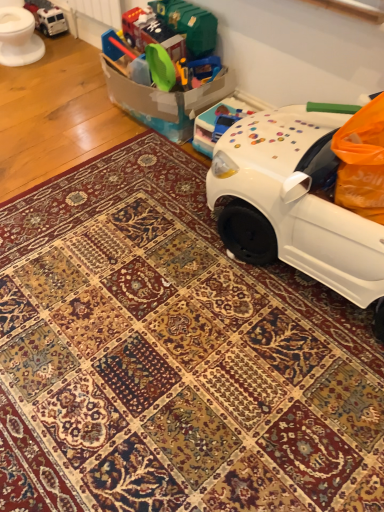
Where is `metallic silver truck at upper left, arranged as the 1th toy when viewed from the top`? metallic silver truck at upper left, arranged as the 1th toy when viewed from the top is located at coordinates (47, 17).

The height and width of the screenshot is (512, 384). Describe the element at coordinates (216, 123) in the screenshot. I see `translucent plastic toy car at upper right, the 2th toy viewed from the back` at that location.

Locate an element on the screen. The height and width of the screenshot is (512, 384). white glossy toilet bowl at upper left is located at coordinates (19, 37).

Locate an element on the screen. metallic silver truck at upper left, placed as the second toy when sorted from bottom to top is located at coordinates (47, 17).

In terms of height, does translucent plastic toy car at upper right, acting as the 2th toy starting from the top, look taller or shorter compared to white glossy toilet bowl at upper left?

In the image, translucent plastic toy car at upper right, acting as the 2th toy starting from the top, appears to be shorter than white glossy toilet bowl at upper left.

From the image's perspective, which is below, translucent plastic toy car at upper right, which is the 1th toy in bottom-to-top order, or white glossy toilet bowl at upper left?

translucent plastic toy car at upper right, which is the 1th toy in bottom-to-top order, appears lower in the image.

Is point (219, 102) closer or farther from the camera than point (32, 56)?

Point (219, 102) is positioned closer to the camera compared to point (32, 56).

Is white glossy toilet bowl at upper left oriented towards translucent plastic toy car at upper right, the 2th toy viewed from the back?

No, white glossy toilet bowl at upper left is not turned towards translucent plastic toy car at upper right, the 2th toy viewed from the back.

Is white glossy toilet bowl at upper left thinner than translucent plastic toy car at upper right, the 2th toy viewed from the back?

No, white glossy toilet bowl at upper left is not thinner than translucent plastic toy car at upper right, the 2th toy viewed from the back.

Can you confirm if white glossy toilet bowl at upper left is positioned to the left of translucent plastic toy car at upper right, which is the 1th toy in front-to-back order?

Yes, white glossy toilet bowl at upper left is to the left of translucent plastic toy car at upper right, which is the 1th toy in front-to-back order.

Is metallic silver truck at upper left, which is counted as the 2th toy, starting from the right, bigger than translucent plastic toy car at upper right, which is the 1th toy in front-to-back order?

Incorrect, metallic silver truck at upper left, which is counted as the 2th toy, starting from the right, is not larger than translucent plastic toy car at upper right, which is the 1th toy in front-to-back order.

Is metallic silver truck at upper left, which is counted as the 2th toy, starting from the right, located outside translucent plastic toy car at upper right, which is the 1th toy in front-to-back order?

Yes, metallic silver truck at upper left, which is counted as the 2th toy, starting from the right, is outside of translucent plastic toy car at upper right, which is the 1th toy in front-to-back order.

From a real-world perspective, which is physically below, metallic silver truck at upper left, which is counted as the 2th toy, starting from the right, or translucent plastic toy car at upper right, the 2th toy viewed from the back?

metallic silver truck at upper left, which is counted as the 2th toy, starting from the right, is physically lower.

Between white glossy toilet bowl at upper left and metallic silver truck at upper left, which is counted as the 2th toy, starting from the front, which one has smaller width?

With smaller width is metallic silver truck at upper left, which is counted as the 2th toy, starting from the front.

Would you consider white glossy toilet bowl at upper left to be distant from metallic silver truck at upper left, placed as the second toy when sorted from bottom to top?

white glossy toilet bowl at upper left is near metallic silver truck at upper left, placed as the second toy when sorted from bottom to top, not far away.

Is metallic silver truck at upper left, which is counted as the 2th toy, starting from the right, inside white glossy toilet bowl at upper left?

No, metallic silver truck at upper left, which is counted as the 2th toy, starting from the right, is not surrounded by white glossy toilet bowl at upper left.

Between white glossy toilet bowl at upper left and metallic silver truck at upper left, which is counted as the 2th toy, starting from the right, which one has larger size?

white glossy toilet bowl at upper left is bigger.

Do you think translucent plastic toy car at upper right, which is the 1th toy in bottom-to-top order, is within metallic silver truck at upper left, which is counted as the 2th toy, starting from the front, or outside of it?

translucent plastic toy car at upper right, which is the 1th toy in bottom-to-top order, lies outside metallic silver truck at upper left, which is counted as the 2th toy, starting from the front.

Is the depth of translucent plastic toy car at upper right, acting as the 2th toy starting from the top, greater than that of metallic silver truck at upper left, arranged as the 1th toy when viewed from the top?

No.

In the scene shown: From the image's perspective, does translucent plastic toy car at upper right, the 2th toy viewed from the back, appear lower than metallic silver truck at upper left, placed as the second toy when sorted from bottom to top?

Yes.

Are metallic silver truck at upper left, which appears as the first toy when viewed from the back, and white glossy toilet bowl at upper left located far from each other?

metallic silver truck at upper left, which appears as the first toy when viewed from the back, is near white glossy toilet bowl at upper left, not far away.

Based on the photo, is metallic silver truck at upper left, which appears as the first toy when viewed from the left, aimed at white glossy toilet bowl at upper left?

Yes, metallic silver truck at upper left, which appears as the first toy when viewed from the left, is turned towards white glossy toilet bowl at upper left.

From a real-world perspective, is metallic silver truck at upper left, which appears as the first toy when viewed from the left, physically located above or below white glossy toilet bowl at upper left?

In terms of real-world spatial position, metallic silver truck at upper left, which appears as the first toy when viewed from the left, is below white glossy toilet bowl at upper left.

Where is `toy in front of the white glossy toilet bowl at upper left`? This screenshot has height=512, width=384. toy in front of the white glossy toilet bowl at upper left is located at coordinates (216, 123).

Starting from the white glossy toilet bowl at upper left, which toy is the 2nd one to the right? Please provide its 2D coordinates.

[(216, 123)]

Considering their positions, is translucent plastic toy car at upper right, which is counted as the second toy, starting from the left, positioned closer to metallic silver truck at upper left, which is counted as the 2th toy, starting from the right, than white glossy toilet bowl at upper left?

The object closer to metallic silver truck at upper left, which is counted as the 2th toy, starting from the right, is white glossy toilet bowl at upper left.

Looking at the image, which one is located further to white glossy toilet bowl at upper left, translucent plastic toy car at upper right, arranged as the first toy when viewed from the right, or metallic silver truck at upper left, which appears as the first toy when viewed from the back?

translucent plastic toy car at upper right, arranged as the first toy when viewed from the right, lies further to white glossy toilet bowl at upper left than the other object.

Based on their spatial positions, is metallic silver truck at upper left, which is counted as the 2th toy, starting from the front, or translucent plastic toy car at upper right, the 2th toy viewed from the back, further from white glossy toilet bowl at upper left?

translucent plastic toy car at upper right, the 2th toy viewed from the back, is further to white glossy toilet bowl at upper left.

Based on their spatial positions, is metallic silver truck at upper left, placed as the second toy when sorted from bottom to top, or white glossy toilet bowl at upper left closer to translucent plastic toy car at upper right, acting as the 2th toy starting from the top?

Based on the image, white glossy toilet bowl at upper left appears to be nearer to translucent plastic toy car at upper right, acting as the 2th toy starting from the top.

Considering their positions, is white glossy toilet bowl at upper left positioned further to metallic silver truck at upper left, arranged as the 1th toy when viewed from the top, than translucent plastic toy car at upper right, which is the 1th toy in front-to-back order?

translucent plastic toy car at upper right, which is the 1th toy in front-to-back order, lies further to metallic silver truck at upper left, arranged as the 1th toy when viewed from the top, than the other object.

Estimate the real-world distances between objects in this image. Which object is further from translucent plastic toy car at upper right, arranged as the first toy when viewed from the right, white glossy toilet bowl at upper left or metallic silver truck at upper left, which is counted as the 2th toy, starting from the right?

The object further to translucent plastic toy car at upper right, arranged as the first toy when viewed from the right, is metallic silver truck at upper left, which is counted as the 2th toy, starting from the right.

The image size is (384, 512). I want to click on toy located between white glossy toilet bowl at upper left and translucent plastic toy car at upper right, arranged as the first toy when viewed from the right, in the left-right direction, so click(47, 17).